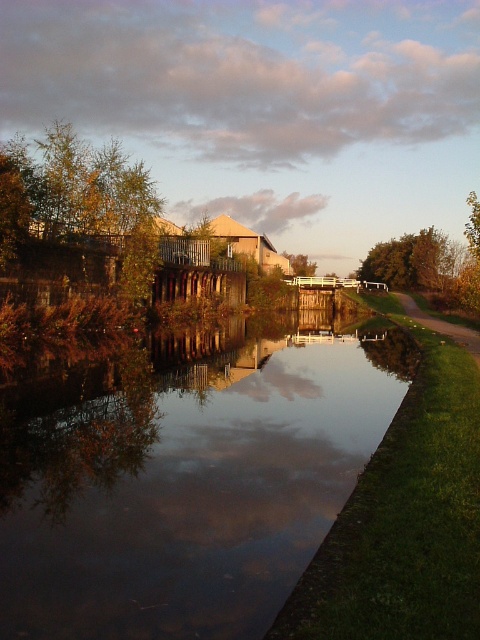
Question: Is green leafy tree at right smaller than green leafy tree at center?

Choices:
 (A) yes
 (B) no

Answer: (B)

Question: Is green leafy tree at right thinner than green leafy tree at center?

Choices:
 (A) no
 (B) yes

Answer: (A)

Question: Is green leafy tree at right in front of green leafy tree at center?

Choices:
 (A) yes
 (B) no

Answer: (A)

Question: Which point appears farthest from the camera in this image?

Choices:
 (A) click(464, 330)
 (B) click(380, 262)
 (C) click(48, 460)

Answer: (B)

Question: Which point is closer to the camera?

Choices:
 (A) (297, 259)
 (B) (433, 291)

Answer: (B)

Question: Which of these objects is positioned closest to the green leafy tree at center?

Choices:
 (A) smooth reflective water at center
 (B) grassy dirt path at lower right

Answer: (B)